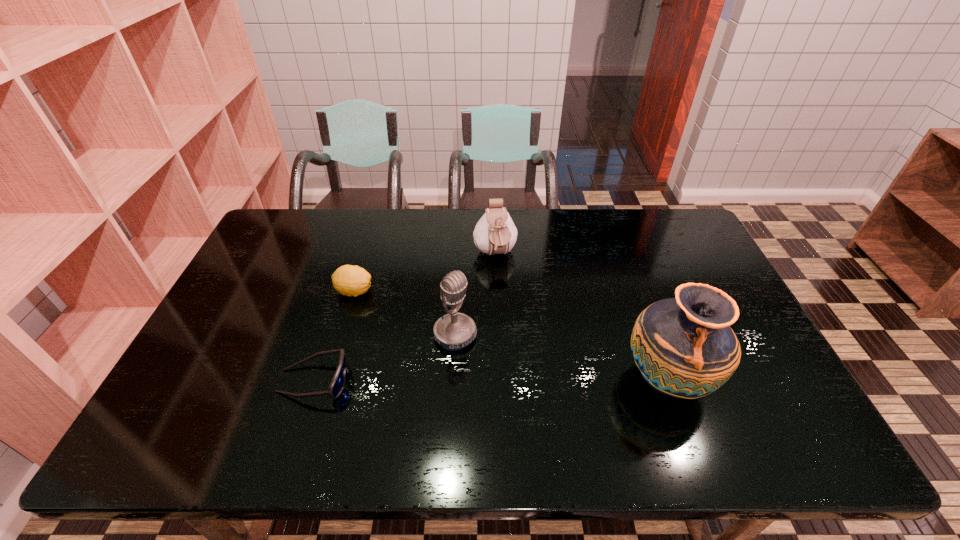
At what (x,y) coordinates should I click in order to perform the action: click on sunglasses situated at the near edge. Please return your answer as a coordinate pair (x, y). The width and height of the screenshot is (960, 540). Looking at the image, I should click on (337, 384).

The height and width of the screenshot is (540, 960). Find the location of `pottery located in the near edge section of the desktop`. pottery located in the near edge section of the desktop is located at coordinates (684, 347).

Where is `vacant space at the far edge of the desktop`? vacant space at the far edge of the desktop is located at coordinates (612, 210).

The height and width of the screenshot is (540, 960). Identify the location of free space at the near edge. (677, 407).

Find the location of a particular element. free space at the left edge of the desktop is located at coordinates (293, 251).

Identify the location of vacant region at the far left corner of the desktop. (259, 244).

The width and height of the screenshot is (960, 540). I want to click on vacant position at the far right corner of the desktop, so click(x=647, y=232).

Find the location of a particular element. This screenshot has width=960, height=540. vacant area that lies between the farthest object and the second farthest object is located at coordinates (424, 273).

This screenshot has height=540, width=960. What are the coordinates of `vacant area that lies between the sunglasses and the second farthest object` in the screenshot? It's located at (334, 336).

Where is `free space between the microphone and the lemon`? free space between the microphone and the lemon is located at coordinates (404, 313).